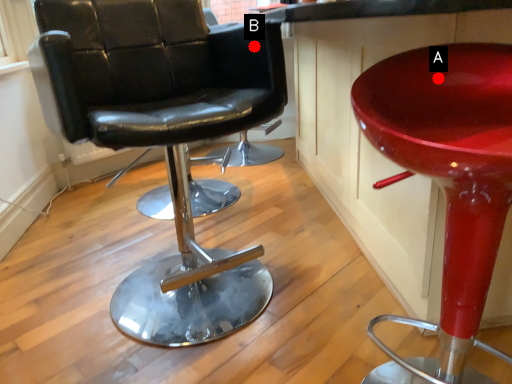
Question: Two points are circled on the image, labeled by A and B beside each circle. Which of the following is the closest to the observer?

Choices:
 (A) A is closer
 (B) B is closer

Answer: (A)